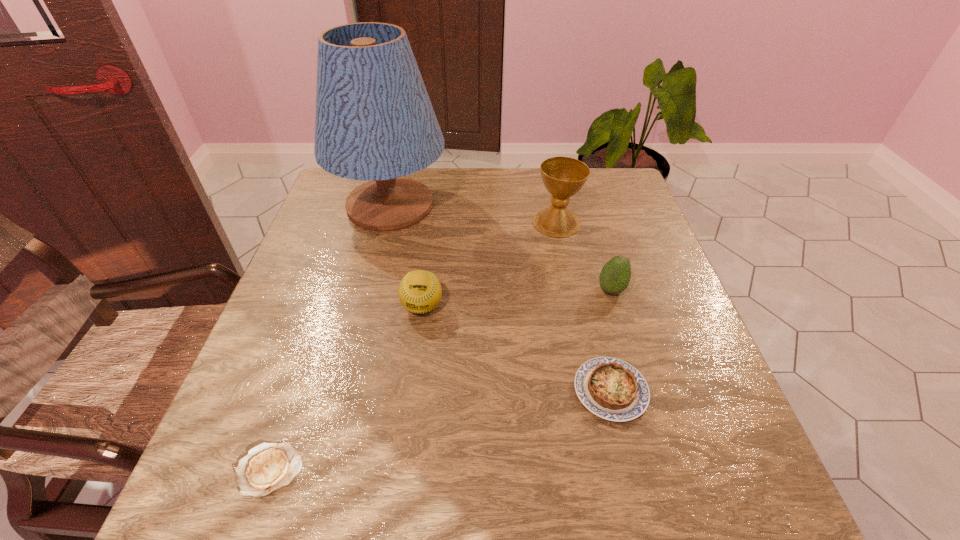
At what (x,y) coordinates should I click in order to perform the action: click on quiche present at the right edge. Please return your answer as a coordinate pair (x, y). Image resolution: width=960 pixels, height=540 pixels. Looking at the image, I should click on (610, 388).

Locate an element on the screen. object that is at the far left corner is located at coordinates (374, 121).

Where is `object positioned at the near left corner`? This screenshot has width=960, height=540. object positioned at the near left corner is located at coordinates (267, 467).

Where is `vacant space at the far edge of the desktop`? This screenshot has width=960, height=540. vacant space at the far edge of the desktop is located at coordinates (439, 183).

In the image, there is a desktop. Where is `vacant region at the near edge`? Image resolution: width=960 pixels, height=540 pixels. vacant region at the near edge is located at coordinates (336, 519).

This screenshot has height=540, width=960. I want to click on vacant space at the left edge of the desktop, so pos(306,262).

Locate an element on the screen. The image size is (960, 540). vacant region at the right edge of the desktop is located at coordinates (643, 367).

This screenshot has height=540, width=960. In the image, there is a desktop. Find the location of `vacant space at the far left corner`. vacant space at the far left corner is located at coordinates point(347,188).

You are a GUI agent. You are given a task and a screenshot of the screen. Output one action in this format:
    pyautogui.click(x=<x>, y=<y>)
    Task: Click on the vacant space that is in between the avocado and the second nearest object
    The height and width of the screenshot is (540, 960).
    Given the screenshot: What is the action you would take?
    pyautogui.click(x=611, y=340)

Where is `unoccupied position between the softball and the chalice`? unoccupied position between the softball and the chalice is located at coordinates (490, 265).